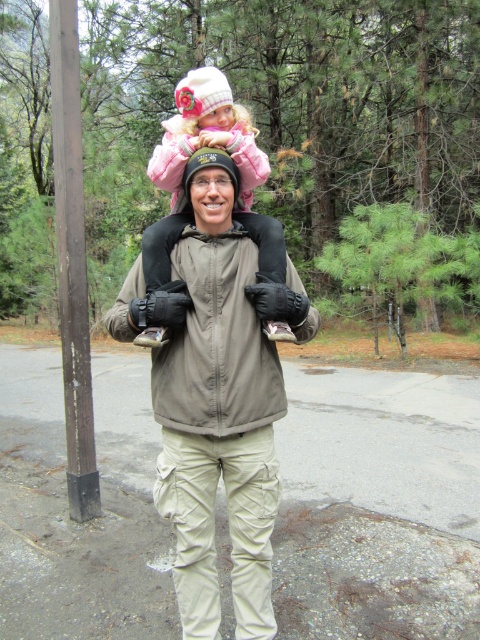
You are standing in the forest and see two points marked in the image. Which point is closer to you, point (x=170, y=422) or point (x=176, y=145)?

Point (x=170, y=422) is closer to the viewer than point (x=176, y=145).

You are a photographer trying to capture a photo of the tan fabric backpack at center and the pink fleece jacket at upper center. The camera has a minimum focus distance of 16 inches. Can you focus on both objects without moving the camera?

The distance between the tan fabric backpack at center and the pink fleece jacket at upper center is 17.18 inches, which is greater than the camera minimum focus distance of 16 inches. Therefore, the camera can focus on both objects without moving.

You are a photographer trying to capture a clear photo of the tan fabric backpack at center and the pink fleece jacket at upper center. Which object should you focus on first to ensure both are in focus?

The tan fabric backpack at center is closer to the viewer than the pink fleece jacket at upper center. To ensure both are in focus, focus on the tan fabric backpack at center first since it is closer, and the depth of field will likely include the pink fleece jacket at upper center in the background.